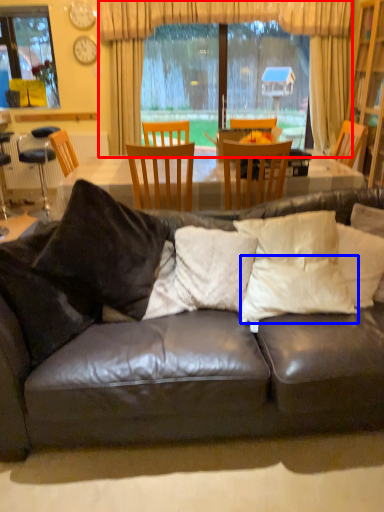
Question: Which object appears closest to the camera in this image, curtain (highlighted by a red box) or pillow (highlighted by a blue box)?

Choices:
 (A) curtain
 (B) pillow

Answer: (B)